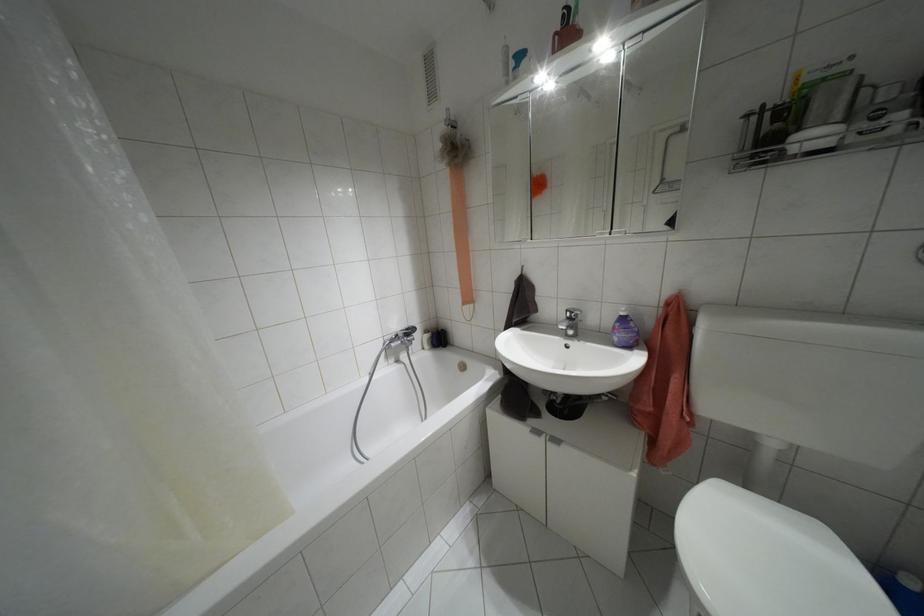
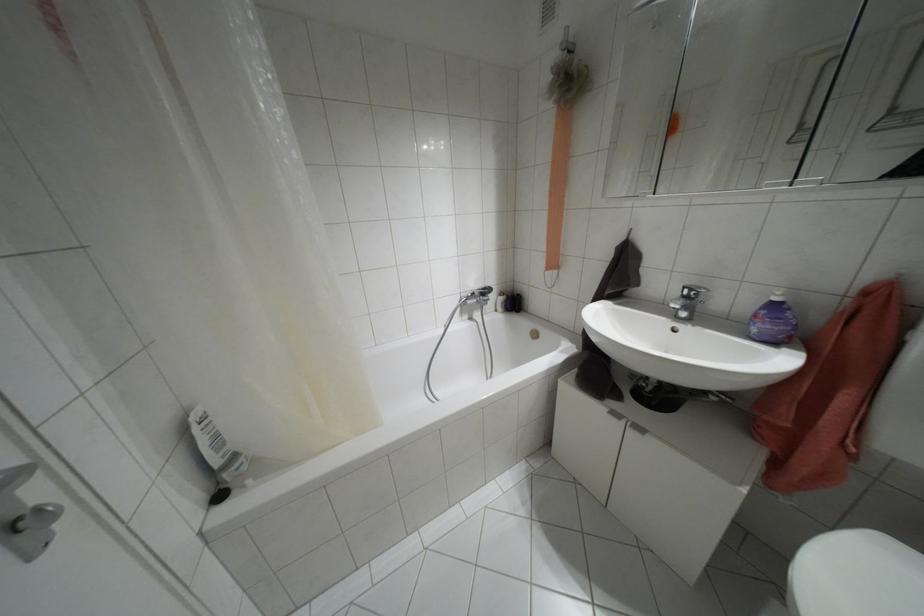
Question: Based on the continuous images, in which direction is the camera rotating? Reply with the corresponding letter.

Choices:
 (A) Left
 (B) Right
 (C) Up
 (D) Down

Answer: (A)